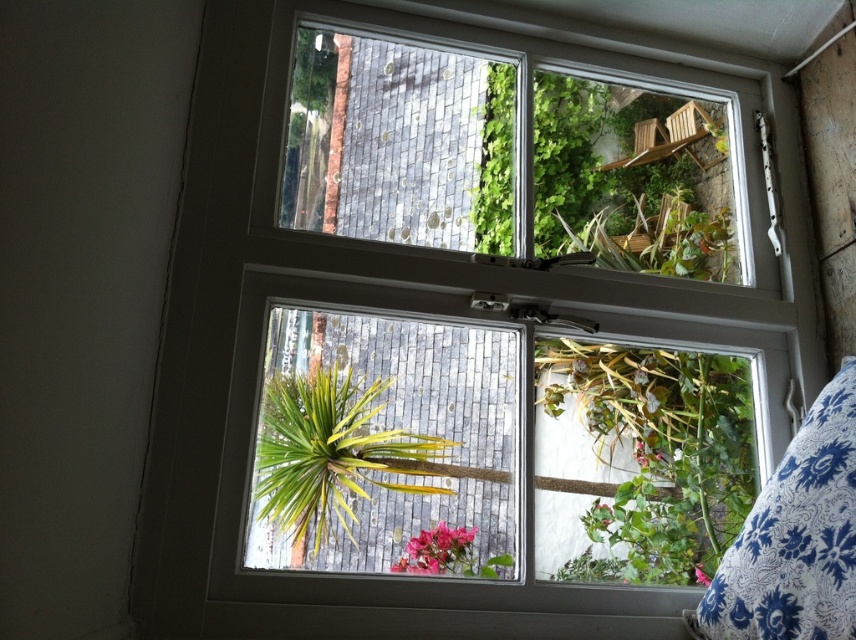
Describe the element at coordinates (639, 461) in the screenshot. I see `green leafy plant at lower right` at that location.

Is green leafy plant at lower right bigger than green leafy plant at center?

Indeed, green leafy plant at lower right has a larger size compared to green leafy plant at center.

Is point (666, 416) behind point (367, 417)?

Yes, it is.

I want to click on green leafy plant at lower right, so 639,461.

Image resolution: width=856 pixels, height=640 pixels. Describe the element at coordinates (639, 461) in the screenshot. I see `green leafy plant at lower right` at that location.

Is point (575, 440) farther from viewer compared to point (791, 545)?

Yes.

This screenshot has width=856, height=640. Find the location of `green leafy plant at lower right`. green leafy plant at lower right is located at coordinates (639, 461).

Is green leafy plant at center taller than pink matte flower at lower center?

Yes.

Who is more forward, (304, 420) or (462, 563)?

Point (304, 420)

Locate an element on the screen. The image size is (856, 640). green leafy plant at center is located at coordinates (328, 451).

At what (x,y) coordinates should I click in order to perform the action: click on green leafy plant at center. Please return your answer as a coordinate pair (x, y). Looking at the image, I should click on (328, 451).